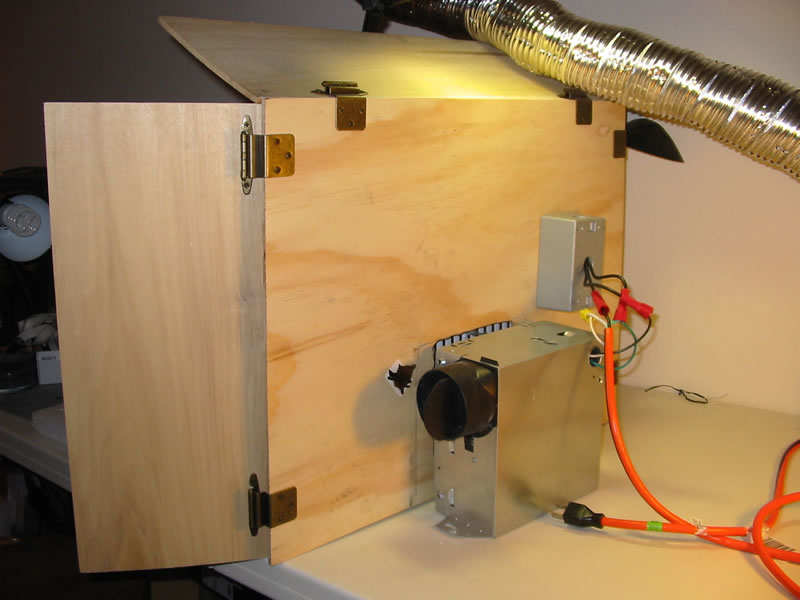
I want to click on black wire, so click(618, 276), click(614, 293), click(593, 282).